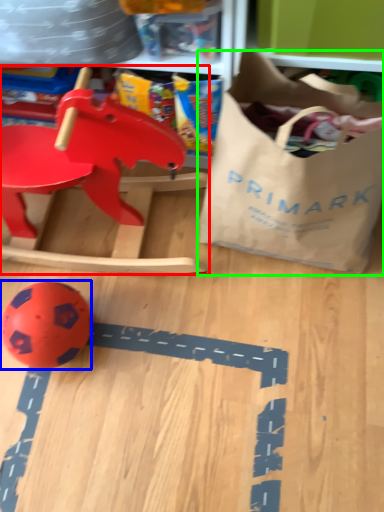
Question: Estimate the real-world distances between objects in this image. Which object is farther from toy (highlighted by a red box), toy (highlighted by a blue box) or grocery bag (highlighted by a green box)?

Choices:
 (A) toy
 (B) grocery bag

Answer: (A)